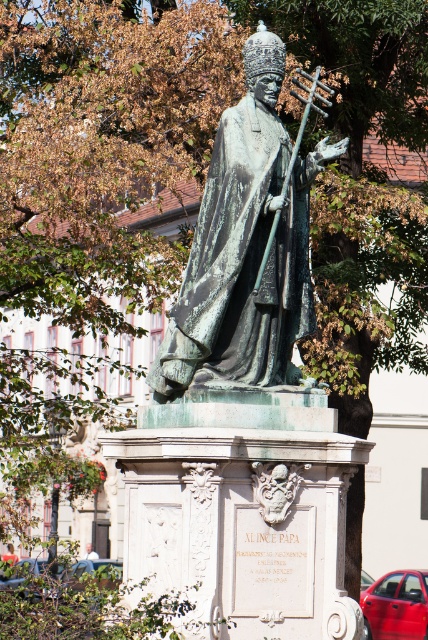
You are standing in a park and see the green patina statue at center and the red fabric umbrella at lower left. Which object is positioned more to the east?

The green patina statue at center is to the right of red fabric umbrella at lower left, so if you are facing north, the statue is more to the east.

You are an art conservator examining the statue. You notice two points on the statue, one at coordinate point (14, 563) and another at point (88, 547). Which point is nearer to your current position?

Point (14, 563) is closer to the viewer than point (88, 547). Therefore, the point at coordinate point (14, 563) is nearer to your current position.